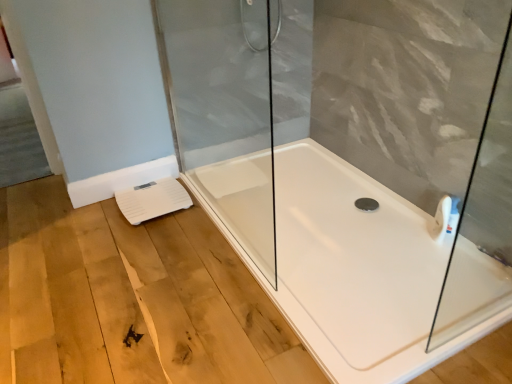
Find the location of `free space between white plastic scale at lower left and transparent glass shower door at center`. free space between white plastic scale at lower left and transparent glass shower door at center is located at coordinates (196, 236).